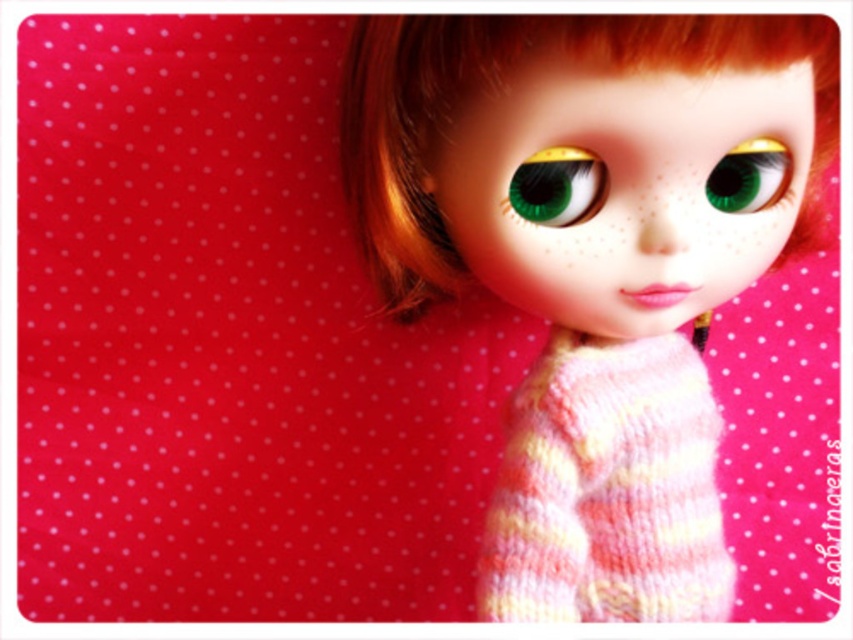
You are holding a camera and want to take a photo of the doll. The camera is currently positioned at point (457, 68). The recommended distance for capturing clear photos is between 30 to 35 inches. Is the camera at the correct distance?

The camera is 33.64 inches away from the point (457, 68), which falls within the recommended 30 to 35 inches range. Therefore, the camera is at the correct distance.